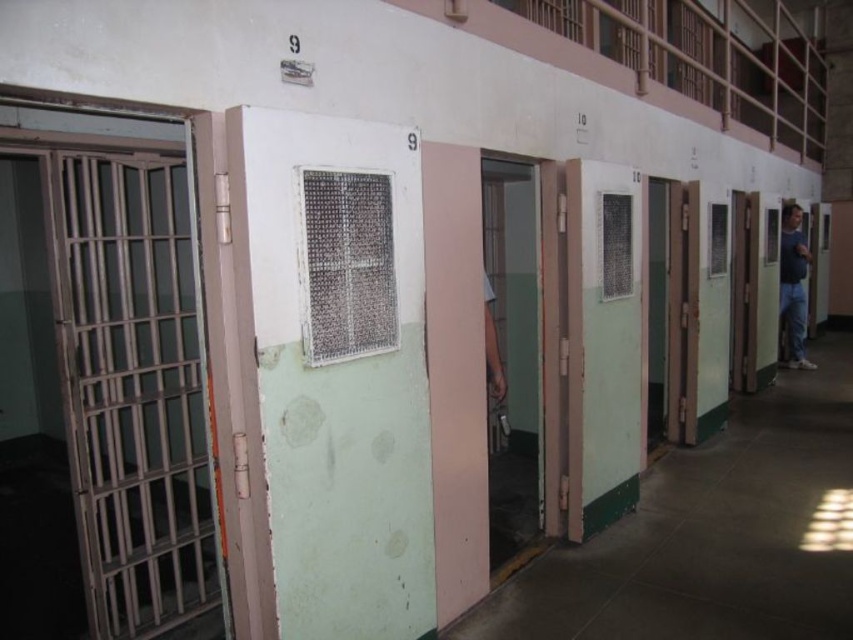
You are standing in front of the prison cells numbered 9 and 10. There are two points marked in the image, one at coordinates point (619, 481) and another at point (795, 349). Which of these points is nearer to you?

Point (619, 481) is closer to the camera than point (795, 349).

You are a prison guard standing in the hallway. You need to check the height of the green matte door at center and the blue jeans at right. Which object is taller?

The green matte door at center is much taller than the blue jeans at right.

You are standing in the prison corridor and need to locate the green matte door at center. According to the coordinates provided, where should you look to find it?

The green matte door at center is located at coordinates point (x=601, y=342).